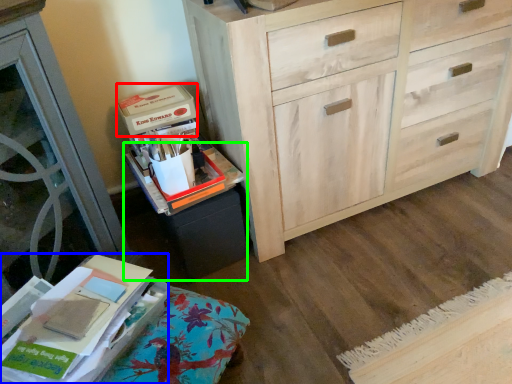
Question: Based on their relative distances, which object is nearer to storage box (highlighted by a red box)? Choose from paperback book (highlighted by a blue box) and cabinetry (highlighted by a green box).

Choices:
 (A) paperback book
 (B) cabinetry

Answer: (B)